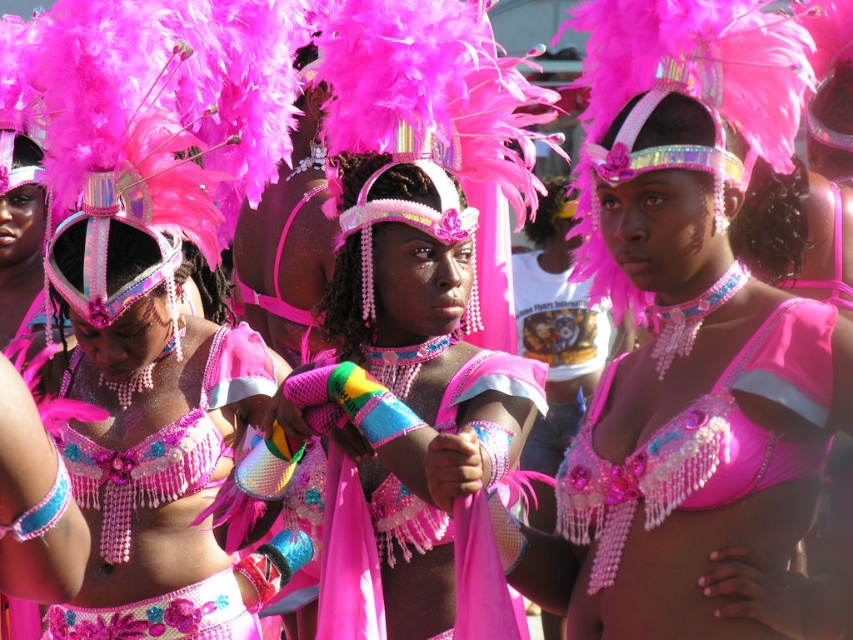
Can you confirm if matte pink bikini at center is positioned above shiny pink bikini top at center?

Yes.

Which is in front, point (456, 388) or point (814, 372)?

Point (814, 372)

I want to click on matte pink bikini at center, so click(x=421, y=307).

Between shiny pink bikini top at center and pink beaded bikini top at center, which one is positioned higher?

shiny pink bikini top at center is above.

Identify the location of shiny pink bikini top at center. (701, 440).

Is matte pink bikini at center further to the viewer compared to pink beaded bikini top at center?

No, matte pink bikini at center is closer to the viewer.

Which is more to the left, matte pink bikini at center or pink beaded bikini top at center?

Positioned to the left is pink beaded bikini top at center.

Is point (459, 378) behind point (79, 436)?

No, (459, 378) is in front of (79, 436).

Locate an element on the screen. This screenshot has height=640, width=853. matte pink bikini at center is located at coordinates (421, 307).